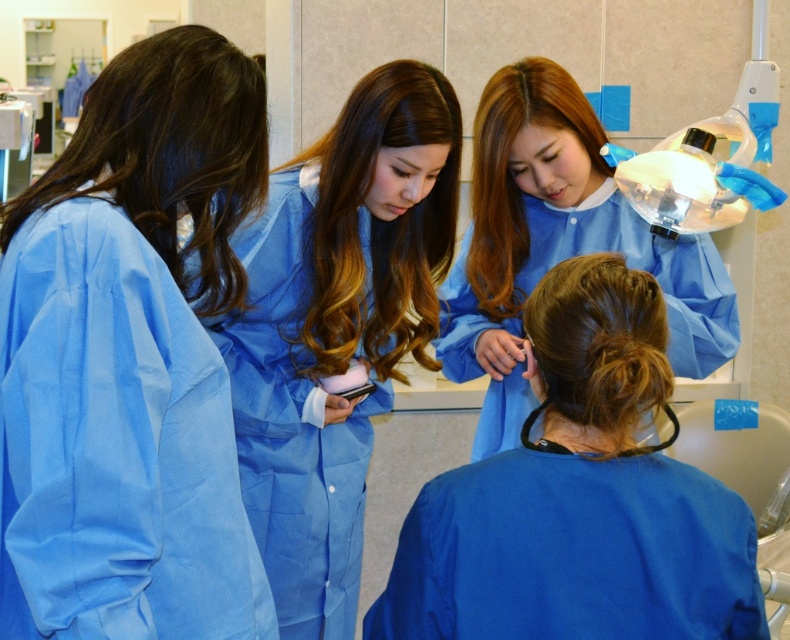
Question: Estimate the real-world distances between objects in this image. Which object is farther from the blue smooth uniform at upper center?

Choices:
 (A) blue smooth scrubs at lower center
 (B) blue smooth scrubs at left
 (C) brown shiny hair at center

Answer: (B)

Question: Which point is closer to the camera taking this photo?

Choices:
 (A) (533, 97)
 (B) (325, 349)

Answer: (B)

Question: Which point appears closest to the camera in this image?

Choices:
 (A) (567, 620)
 (B) (514, 140)

Answer: (A)

Question: Does blue smooth scrubs at center have a greater width compared to shiny brown hair at upper center?

Choices:
 (A) no
 (B) yes

Answer: (B)

Question: Is blue smooth scrubs at center smaller than shiny brown hair at upper center?

Choices:
 (A) yes
 (B) no

Answer: (B)

Question: Can you confirm if blue smooth scrubs at left is smaller than shiny brown hair at upper center?

Choices:
 (A) yes
 (B) no

Answer: (B)